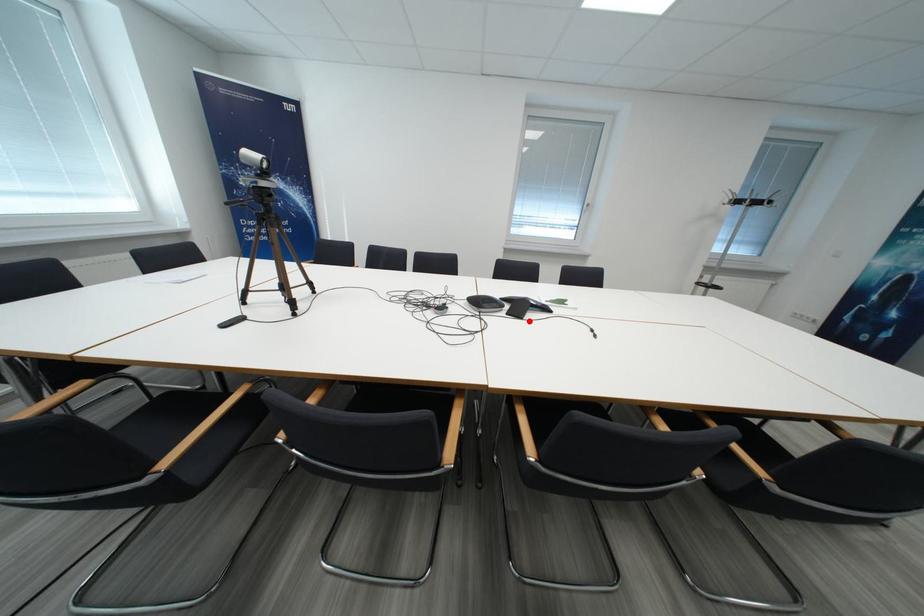
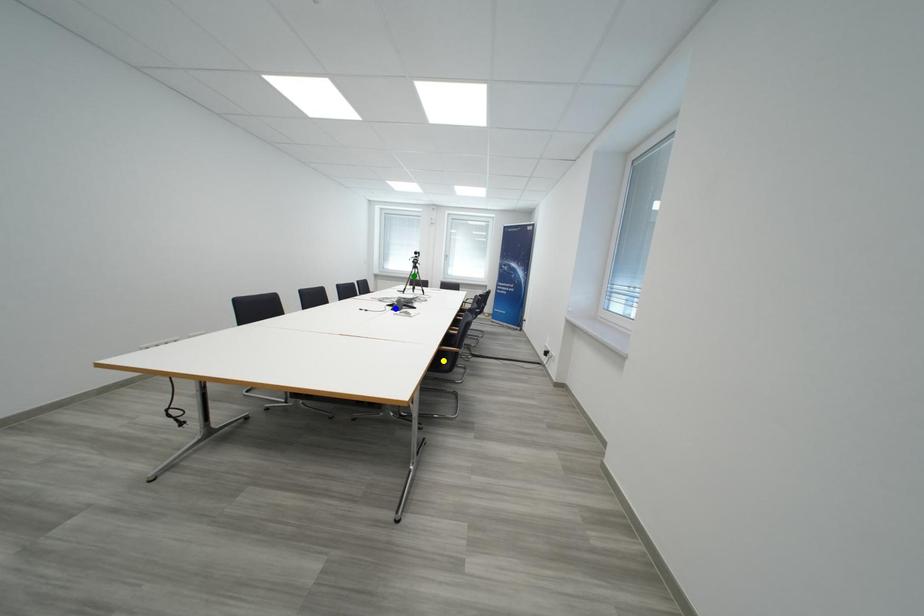
Question: I am providing you with two images of the same scene from different viewpoints. A red point is marked on the first image. You are given multiple points on the second image. Which mark in image 2 goes with the point in image 1?

Choices:
 (A) green point
 (B) blue point
 (C) yellow point

Answer: (B)